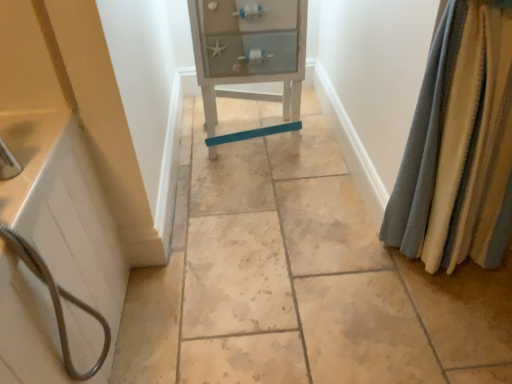
This screenshot has height=384, width=512. What are the coordinates of `free space in front of white wood cabinet at center` in the screenshot? It's located at (262, 198).